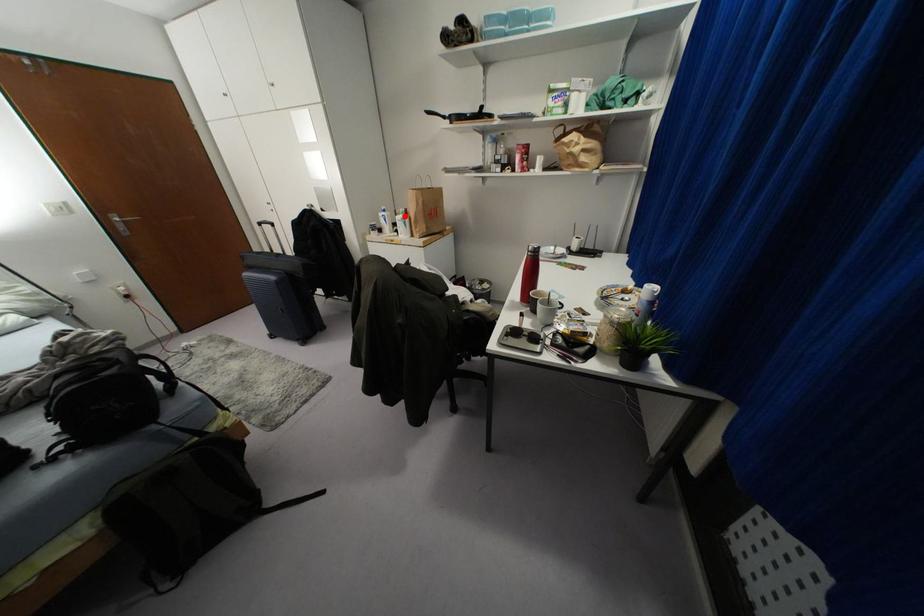
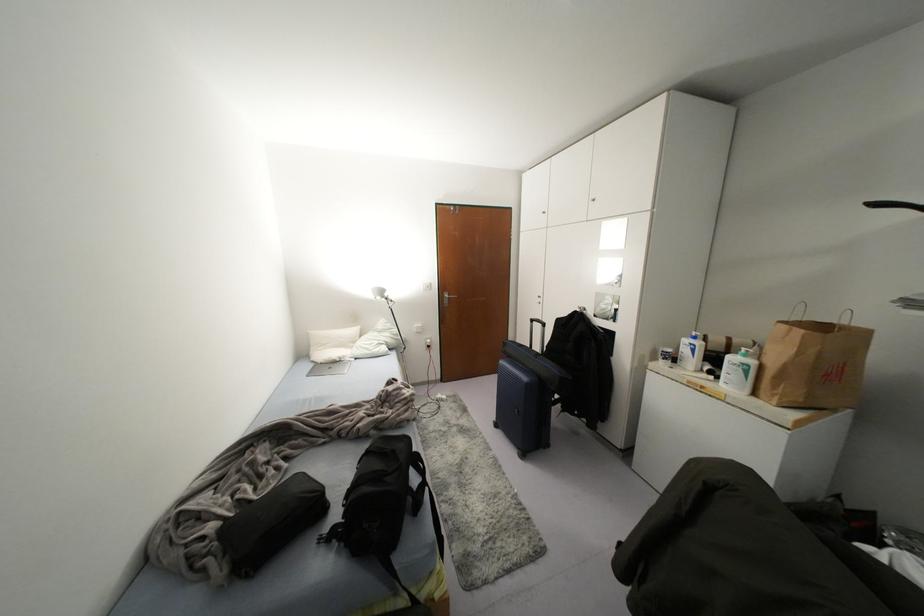
Question: I am providing you with two images of the same scene from different viewpoints. In image1, a red point is highlighted. Considering the same 3D point in image2, which of the following is correct?

Choices:
 (A) It is closer
 (B) It is farther

Answer: (B)